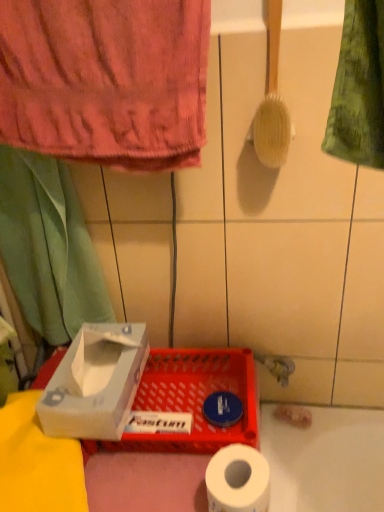
Where is `unoccupied area behind white matte toilet paper at lower center`? The image size is (384, 512). unoccupied area behind white matte toilet paper at lower center is located at coordinates (198, 432).